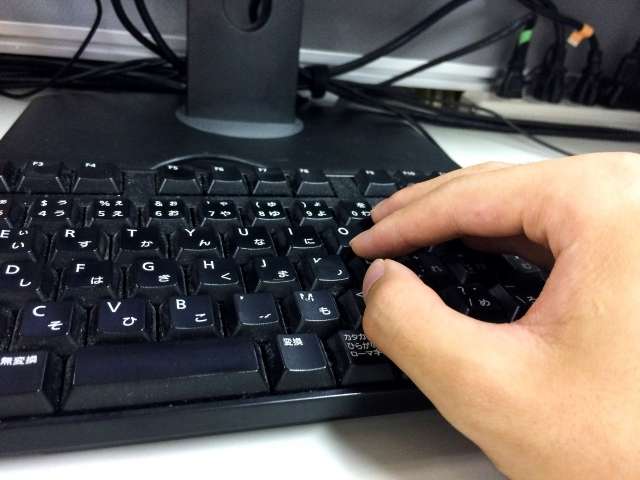
In order to click on gray wall in this screenshot , I will do `click(365, 26)`.